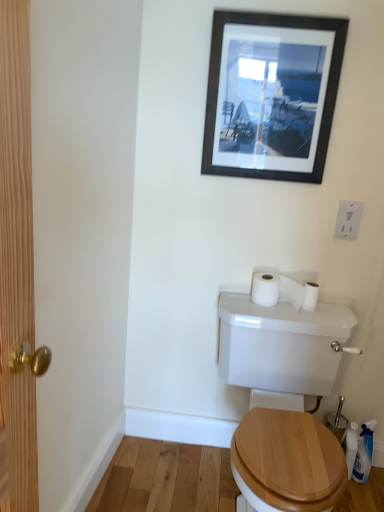
Question: From the image's perspective, is white matte toilet paper at upper right, the 2th toilet paper positioned from the left, located above white plastic switch at upper right?

Choices:
 (A) no
 (B) yes

Answer: (A)

Question: Would you say white matte toilet paper at upper right, the 2th toilet paper positioned from the left, contains white plastic switch at upper right?

Choices:
 (A) no
 (B) yes

Answer: (A)

Question: Is white matte toilet paper at upper right, positioned as the first toilet paper in right-to-left order, outside of white plastic switch at upper right?

Choices:
 (A) no
 (B) yes

Answer: (B)

Question: Does white matte toilet paper at upper right, positioned as the first toilet paper in right-to-left order, have a greater height compared to white plastic switch at upper right?

Choices:
 (A) no
 (B) yes

Answer: (A)

Question: Is white matte toilet paper at upper right, positioned as the first toilet paper in right-to-left order, to the left of white plastic switch at upper right from the viewer's perspective?

Choices:
 (A) yes
 (B) no

Answer: (A)

Question: From a real-world perspective, is white matte toilet paper at upper right, positioned as the first toilet paper in right-to-left order, below white plastic switch at upper right?

Choices:
 (A) yes
 (B) no

Answer: (A)

Question: Does white plastic switch at upper right turn towards white matte toilet paper at upper right, the 2th toilet paper positioned from the left?

Choices:
 (A) no
 (B) yes

Answer: (A)

Question: Is white plastic switch at upper right at the right side of white matte toilet paper at upper right, positioned as the first toilet paper in right-to-left order?

Choices:
 (A) no
 (B) yes

Answer: (B)

Question: Can you confirm if white plastic switch at upper right is positioned to the left of white matte toilet paper at upper right, the 2th toilet paper positioned from the left?

Choices:
 (A) no
 (B) yes

Answer: (A)

Question: Does white plastic switch at upper right have a smaller size compared to white matte toilet paper at upper right, positioned as the first toilet paper in right-to-left order?

Choices:
 (A) no
 (B) yes

Answer: (B)

Question: Can we say white plastic switch at upper right lies outside white matte toilet paper at upper right, positioned as the first toilet paper in right-to-left order?

Choices:
 (A) yes
 (B) no

Answer: (A)

Question: Can you confirm if white plastic switch at upper right is thinner than white matte toilet paper at upper right, positioned as the first toilet paper in right-to-left order?

Choices:
 (A) no
 (B) yes

Answer: (B)

Question: Is white glossy toilet at center outside of white plastic switch at upper right?

Choices:
 (A) yes
 (B) no

Answer: (A)